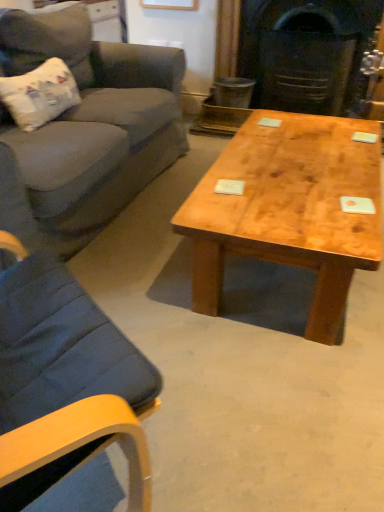
Find the location of a particular element. This screenshot has width=384, height=512. natural wood coffee table at center is located at coordinates (289, 209).

Describe the element at coordinates (289, 209) in the screenshot. I see `natural wood coffee table at center` at that location.

What is the approximate height of dark gray stone fireplace at center?

dark gray stone fireplace at center is 30.66 inches in height.

The width and height of the screenshot is (384, 512). What are the coordinates of `natural wood coffee table at center` in the screenshot? It's located at (289, 209).

Which object is further away from the camera, white paper-like pillow at left or dark gray stone fireplace at center?

Positioned behind is dark gray stone fireplace at center.

Locate an element on the screen. This screenshot has height=512, width=384. fireplace below the white paper-like pillow at left (from a real-world perspective) is located at coordinates (305, 51).

Looking at this image, in terms of width, does white paper-like pillow at left look wider or thinner when compared to dark gray stone fireplace at center?

Considering their sizes, white paper-like pillow at left looks slimmer than dark gray stone fireplace at center.

Could you tell me if white paper-like pillow at left is turned towards dark gray stone fireplace at center?

No, white paper-like pillow at left is not facing towards dark gray stone fireplace at center.

Which is closer, (15, 115) or (207, 247)?

The point (207, 247) is in front.

Considering the relative sizes of white paper-like pillow at left and natural wood coffee table at center in the image provided, is white paper-like pillow at left smaller than natural wood coffee table at center?

Yes.

Is white paper-like pillow at left looking in the opposite direction of natural wood coffee table at center?

No.

Is white paper-like pillow at left beside natural wood coffee table at center?

There is a gap between white paper-like pillow at left and natural wood coffee table at center.

Is point (59, 77) positioned after point (89, 84)?

That is False.

Is the depth of white paper-like pillow at left less than that of velvet gray couch at left?

No, white paper-like pillow at left is behind velvet gray couch at left.

Which object is positioned more to the left, white paper-like pillow at left or velvet gray couch at left?

velvet gray couch at left is more to the left.

Is white paper-like pillow at left located outside velvet gray couch at left?

That's incorrect, white paper-like pillow at left is not completely outside velvet gray couch at left.

From the image's perspective, which one is positioned higher, velvet gray couch at left or white paper-like pillow at left?

white paper-like pillow at left.

Considering the relative positions of velvet gray couch at left and white paper-like pillow at left in the image provided, is velvet gray couch at left to the left or to the right of white paper-like pillow at left?

In the image, velvet gray couch at left appears on the left side of white paper-like pillow at left.

Could you tell me if velvet gray couch at left is facing white paper-like pillow at left?

Yes, velvet gray couch at left is aimed at white paper-like pillow at left.

From a real-world perspective, which object rests below the other?

velvet gray couch at left.

Between velvet gray couch at left and dark gray stone fireplace at center, which one is positioned in front?

velvet gray couch at left is more forward.

Which of these two, velvet gray couch at left or dark gray stone fireplace at center, is wider?

With larger width is velvet gray couch at left.

Is dark gray stone fireplace at center inside the boundaries of white paper-like pillow at left, or outside?

The correct answer is: outside.

Is point (313, 29) positioned before point (22, 77)?

No.

Does dark gray stone fireplace at center have a lesser height compared to white paper-like pillow at left?

Incorrect, the height of dark gray stone fireplace at center does not fall short of that of white paper-like pillow at left.

From the image's perspective, between dark gray stone fireplace at center and velvet gray couch at left, which one is located above?

dark gray stone fireplace at center.

In the image, there is a velvet gray couch at left. What are the coordinates of `fireplace above it (from the image's perspective)` in the screenshot? It's located at (305, 51).

From a real-world perspective, who is located lower, dark gray stone fireplace at center or velvet gray couch at left?

In real-world perspective, velvet gray couch at left is lower.

The image size is (384, 512). What are the coordinates of `pillow above the dark gray stone fireplace at center (from a real-world perspective)` in the screenshot? It's located at (39, 94).

Find the location of `coffee table on the right side of white paper-like pillow at left`. coffee table on the right side of white paper-like pillow at left is located at coordinates (289, 209).

Looking at the image, which one is located further to velvet gray couch at left, white paper-like pillow at left or dark gray stone fireplace at center?

Based on the image, dark gray stone fireplace at center appears to be further to velvet gray couch at left.

Estimate the real-world distances between objects in this image. Which object is further from natural wood coffee table at center, white paper-like pillow at left or dark gray stone fireplace at center?

dark gray stone fireplace at center lies further to natural wood coffee table at center than the other object.

Estimate the real-world distances between objects in this image. Which object is further from dark gray stone fireplace at center, velvet gray couch at left or white paper-like pillow at left?

white paper-like pillow at left.

Which object lies nearer to the anchor point dark gray stone fireplace at center, natural wood coffee table at center or velvet gray couch at left?

Based on the image, velvet gray couch at left appears to be nearer to dark gray stone fireplace at center.

Estimate the real-world distances between objects in this image. Which object is further from white paper-like pillow at left, velvet gray couch at left or dark gray stone fireplace at center?

dark gray stone fireplace at center.

When comparing their distances from natural wood coffee table at center, does white paper-like pillow at left or velvet gray couch at left seem closer?

The object closer to natural wood coffee table at center is velvet gray couch at left.

Based on their spatial positions, is velvet gray couch at left or natural wood coffee table at center further from white paper-like pillow at left?

natural wood coffee table at center is further to white paper-like pillow at left.

Estimate the real-world distances between objects in this image. Which object is further from white paper-like pillow at left, natural wood coffee table at center or velvet gray couch at left?

natural wood coffee table at center lies further to white paper-like pillow at left than the other object.

Locate an element on the screen. pillow between velvet gray couch at left and natural wood coffee table at center from left to right is located at coordinates coord(39,94).

Find the location of `coffee table between velvet gray couch at left and dark gray stone fireplace at center along the z-axis`. coffee table between velvet gray couch at left and dark gray stone fireplace at center along the z-axis is located at coordinates (289, 209).

Find the location of a particular element. coffee table between white paper-like pillow at left and dark gray stone fireplace at center in the horizontal direction is located at coordinates (289, 209).

This screenshot has width=384, height=512. Find the location of `pillow located between velvet gray couch at left and dark gray stone fireplace at center in the left-right direction`. pillow located between velvet gray couch at left and dark gray stone fireplace at center in the left-right direction is located at coordinates (39, 94).